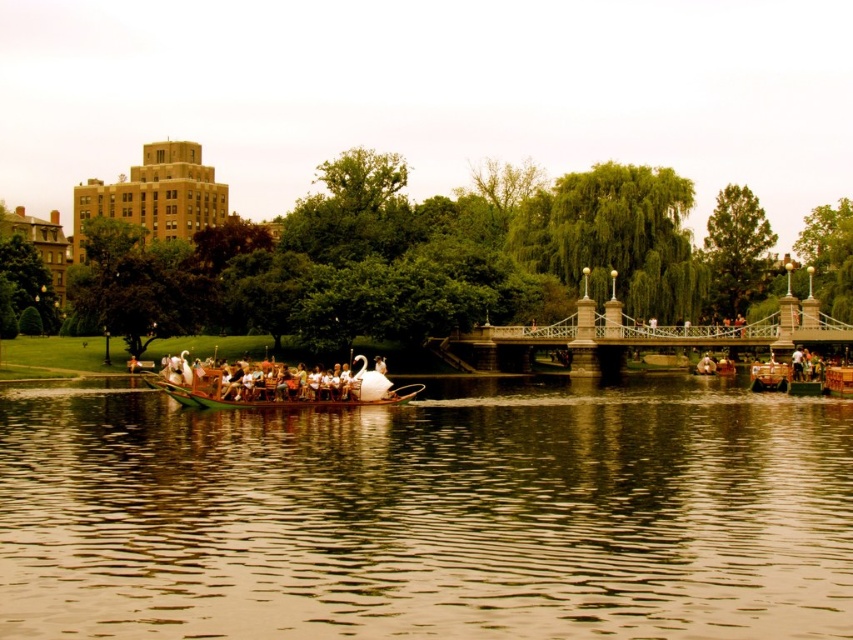
Question: Does brown reflective water at center come behind wooden boat at center?

Choices:
 (A) yes
 (B) no

Answer: (B)

Question: Which object appears closest to the camera in this image?

Choices:
 (A) brown reflective water at center
 (B) wooden boat at center

Answer: (A)

Question: Does brown reflective water at center appear on the left side of wooden boat at center?

Choices:
 (A) no
 (B) yes

Answer: (A)

Question: Can you confirm if brown reflective water at center is positioned above wooden boat at center?

Choices:
 (A) no
 (B) yes

Answer: (A)